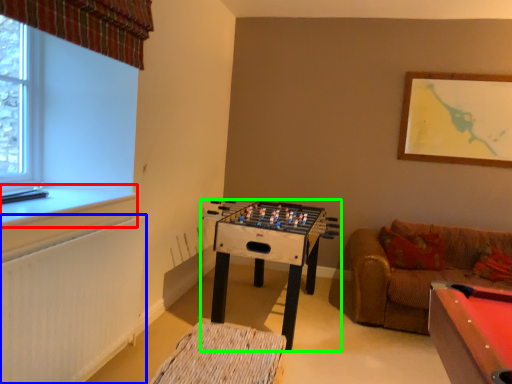
Question: Estimate the real-world distances between objects in this image. Which object is closer to window sill (highlighted by a red box), radiator (highlighted by a blue box) or table (highlighted by a green box)?

Choices:
 (A) radiator
 (B) table

Answer: (A)